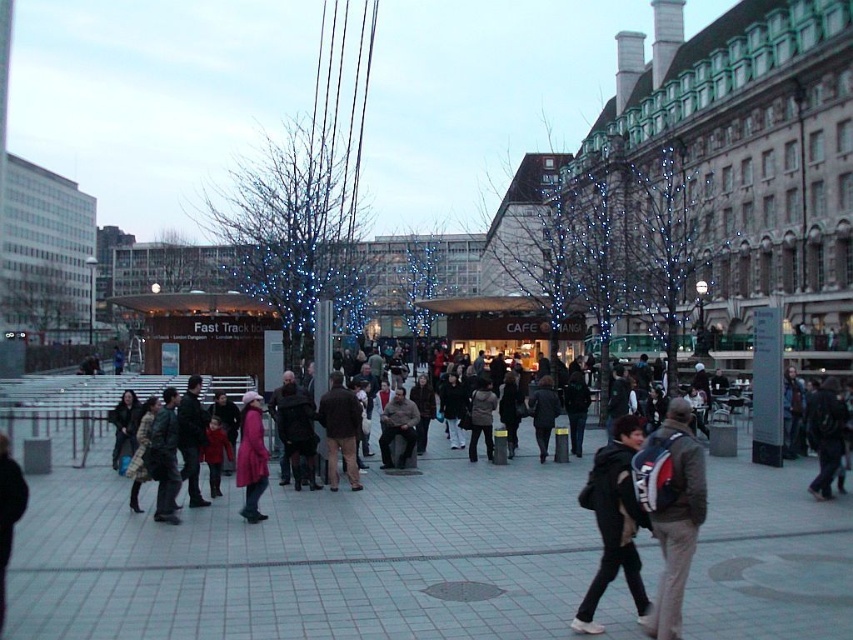
Question: Is matte black jacket at center further to the viewer compared to brown leather jacket at center?

Choices:
 (A) no
 (B) yes

Answer: (A)

Question: Can you confirm if matte black backpack at center is thinner than brown leather jacket at center?

Choices:
 (A) no
 (B) yes

Answer: (A)

Question: Considering the real-world distances, which object is closest to the black matte jacket at lower right?

Choices:
 (A) matte black backpack at center
 (B) pink fabric coat at center
 (C) brown leather jacket at center

Answer: (A)

Question: Which is nearer to the black matte jacket at lower right?

Choices:
 (A) matte black jacket at center
 (B) brown leather jacket at center
 (C) matte black backpack at center
 (D) pink fabric coat at center

Answer: (C)

Question: Which object appears closest to the camera in this image?

Choices:
 (A) matte black backpack at center
 (B) brown leather jacket at center
 (C) pink fabric coat at center

Answer: (A)

Question: Where is pink fabric coat at center located in relation to brown leather jacket at center in the image?

Choices:
 (A) left
 (B) right

Answer: (A)